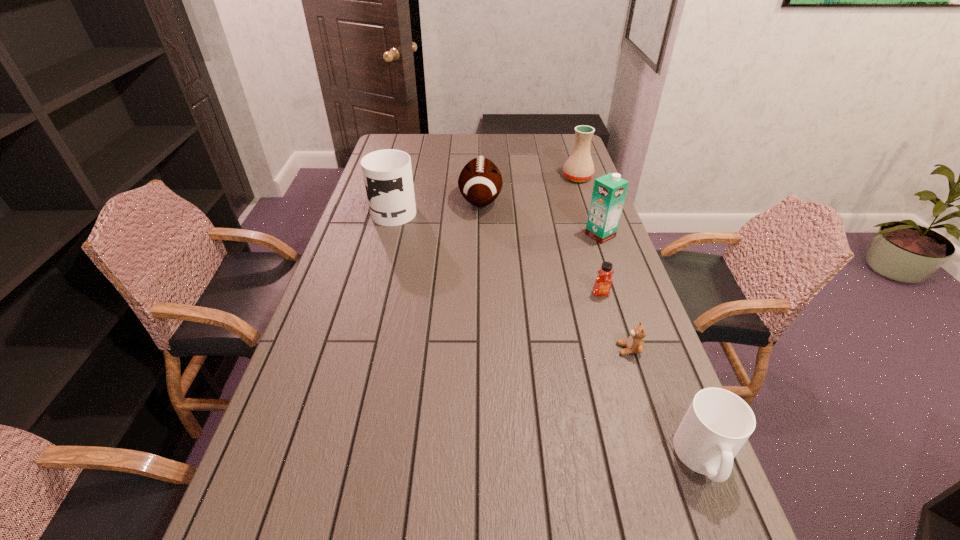
This screenshot has width=960, height=540. In order to click on vacant space located 0.080m on the front-facing side of the shortest object in this screenshot , I will do `click(587, 349)`.

Locate an element on the screen. blank space located on the front-facing side of the shortest object is located at coordinates (525, 349).

Find the location of a particular element. This screenshot has width=960, height=540. object that is at the near edge is located at coordinates (718, 422).

Where is `object at the left edge`? This screenshot has width=960, height=540. object at the left edge is located at coordinates (387, 173).

The image size is (960, 540). What are the coordinates of `mug present at the right edge` in the screenshot? It's located at (718, 422).

In order to click on pottery positioned at the right edge in this screenshot , I will do `click(579, 167)`.

The width and height of the screenshot is (960, 540). I want to click on carton located at the right edge, so click(x=609, y=191).

Locate an element on the screen. honey situated at the right edge is located at coordinates (603, 283).

This screenshot has height=540, width=960. Identify the location of teddy bear positioned at the right edge. (635, 344).

This screenshot has height=540, width=960. I want to click on object that is positioned at the near right corner, so click(x=718, y=422).